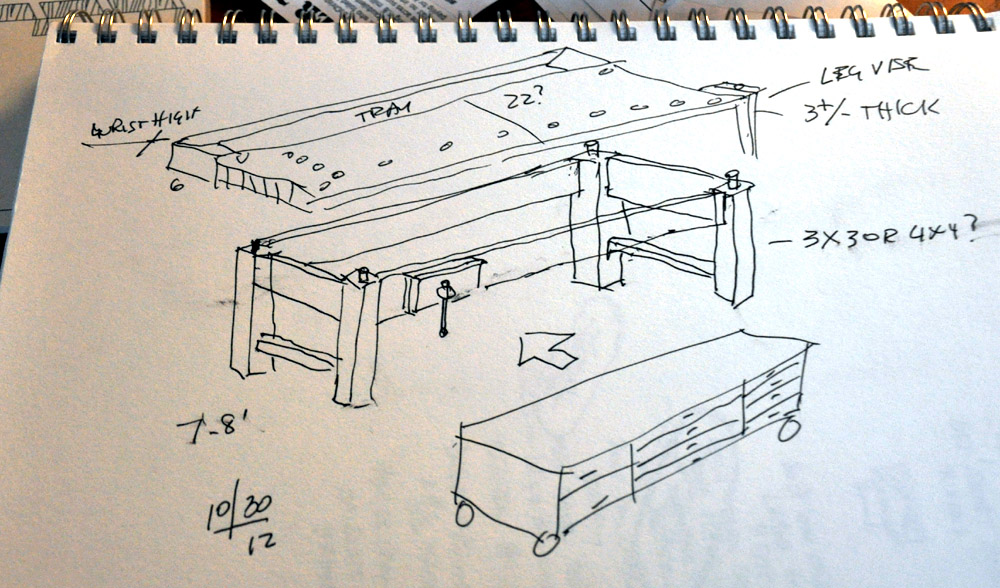
Where is `furniture sketch`? Image resolution: width=1000 pixels, height=588 pixels. furniture sketch is located at coordinates (609, 409), (515, 240), (424, 135).